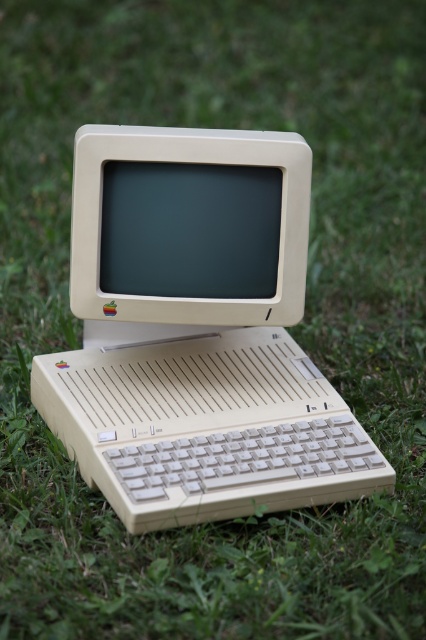
Question: Can you confirm if beige plastic computer at center is wider than beige plastic monitor at center?

Choices:
 (A) no
 (B) yes

Answer: (B)

Question: Which of the following is the closest to the observer?

Choices:
 (A) beige plastic monitor at center
 (B) beige plastic computer at center

Answer: (B)

Question: Observing the image, what is the correct spatial positioning of beige plastic computer at center in reference to beige plastic monitor at center?

Choices:
 (A) right
 (B) left

Answer: (A)

Question: Which of the following is the farthest from the observer?

Choices:
 (A) (144, 372)
 (B) (238, 218)

Answer: (A)

Question: Which point is farther to the camera?

Choices:
 (A) pos(219,365)
 (B) pos(104,157)

Answer: (A)

Question: Is beige plastic computer at center to the right of beige plastic monitor at center from the viewer's perspective?

Choices:
 (A) yes
 (B) no

Answer: (A)